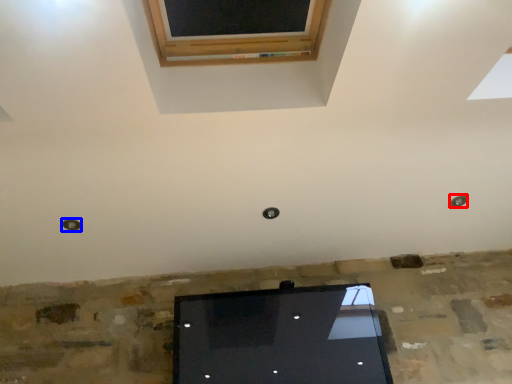
Question: Which object appears farthest to the camera in this image, hole (highlighted by a red box) or hole (highlighted by a blue box)?

Choices:
 (A) hole
 (B) hole

Answer: (A)